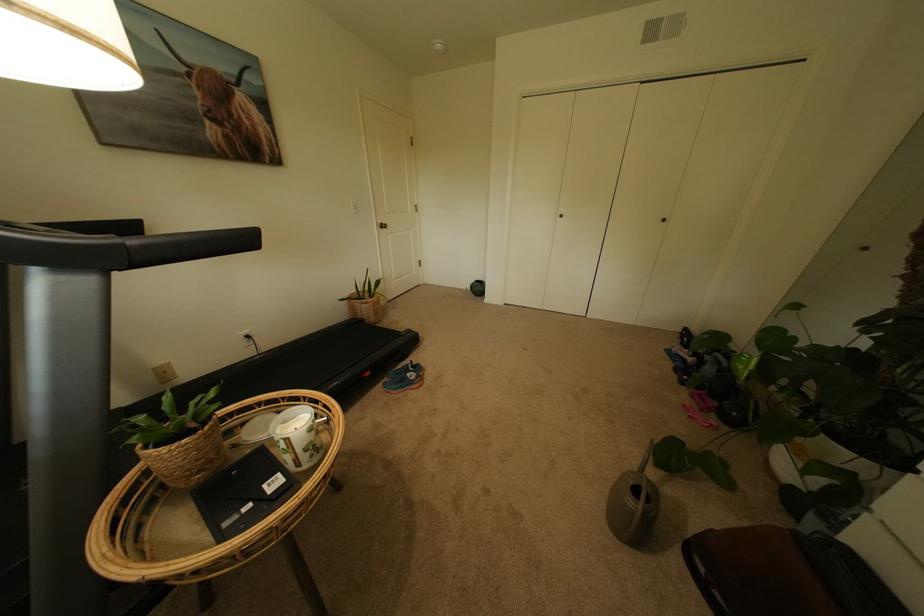
The location [404,378] corresponds to which object?

It refers to a blue running shoes.